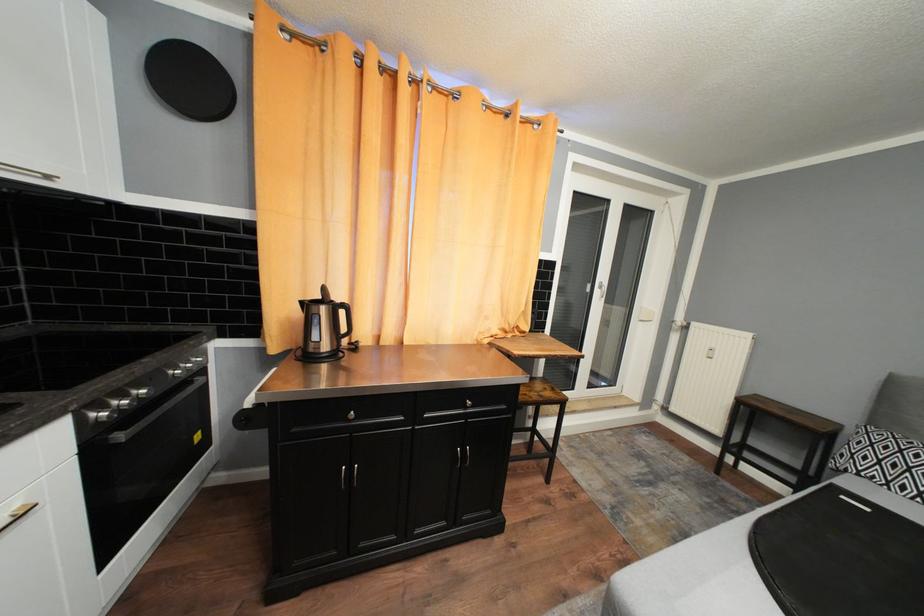
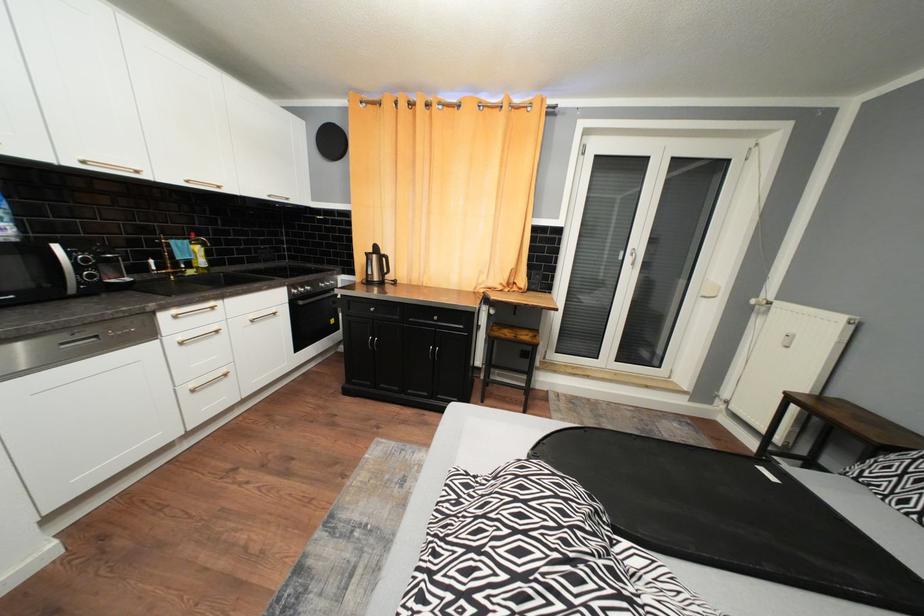
Question: In a continuous first-person perspective shot, in which direction is the camera moving?

Choices:
 (A) Left
 (B) Right
 (C) Forward
 (D) Backward

Answer: (B)